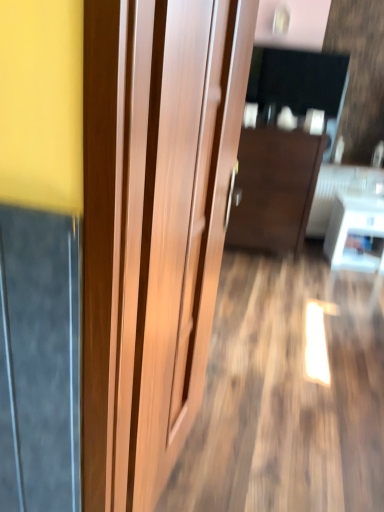
Question: From the image's perspective, is wooden door at center located beneath dark wood cabinet at center?

Choices:
 (A) no
 (B) yes

Answer: (B)

Question: From the image's perspective, would you say wooden door at center is positioned over dark wood cabinet at center?

Choices:
 (A) no
 (B) yes

Answer: (A)

Question: Is wooden door at center not close to dark wood cabinet at center?

Choices:
 (A) no
 (B) yes

Answer: (B)

Question: Does wooden door at center appear on the right side of dark wood cabinet at center?

Choices:
 (A) yes
 (B) no

Answer: (B)

Question: Considering the relative sizes of wooden door at center and dark wood cabinet at center in the image provided, is wooden door at center bigger than dark wood cabinet at center?

Choices:
 (A) yes
 (B) no

Answer: (B)

Question: From a real-world perspective, is wooden door at center on top of dark wood cabinet at center?

Choices:
 (A) no
 (B) yes

Answer: (B)

Question: From a real-world perspective, is white glossy table at lower right physically above wooden door at center?

Choices:
 (A) yes
 (B) no

Answer: (B)

Question: Can you confirm if white glossy table at lower right is thinner than wooden door at center?

Choices:
 (A) no
 (B) yes

Answer: (A)

Question: Can you confirm if white glossy table at lower right is wider than wooden door at center?

Choices:
 (A) no
 (B) yes

Answer: (B)

Question: From the image's perspective, does white glossy table at lower right appear higher than wooden door at center?

Choices:
 (A) no
 (B) yes

Answer: (B)

Question: Is wooden door at center inside white glossy table at lower right?

Choices:
 (A) no
 (B) yes

Answer: (A)

Question: From the image's perspective, is white glossy table at lower right beneath wooden door at center?

Choices:
 (A) yes
 (B) no

Answer: (B)

Question: Is white glossy table at lower right taller than dark wood cabinet at center?

Choices:
 (A) no
 (B) yes

Answer: (A)